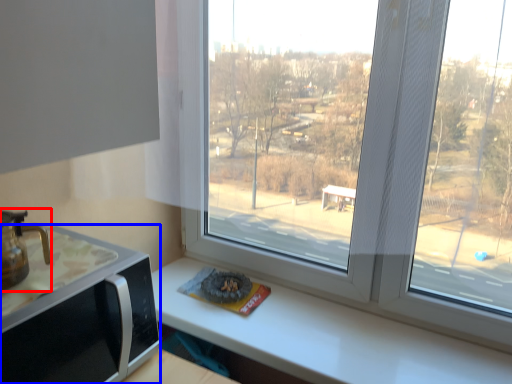
Question: Among these objects, which one is nearest to the camera, coffeepot (highlighted by a red box) or appliance (highlighted by a blue box)?

Choices:
 (A) coffeepot
 (B) appliance

Answer: (B)